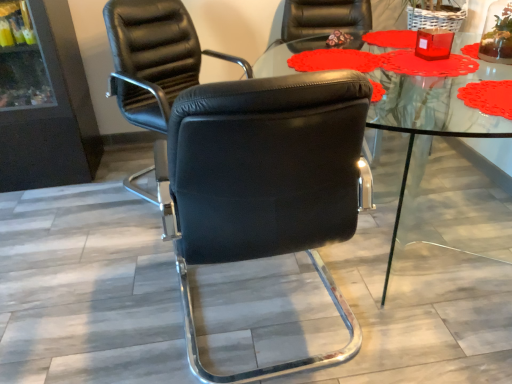
At what (x,y) coordinates should I click in order to perform the action: click on blank area beneath transparent glass table at center (from a real-world perspective). Please return your answer as a coordinate pair (x, y). Looking at the image, I should click on (412, 249).